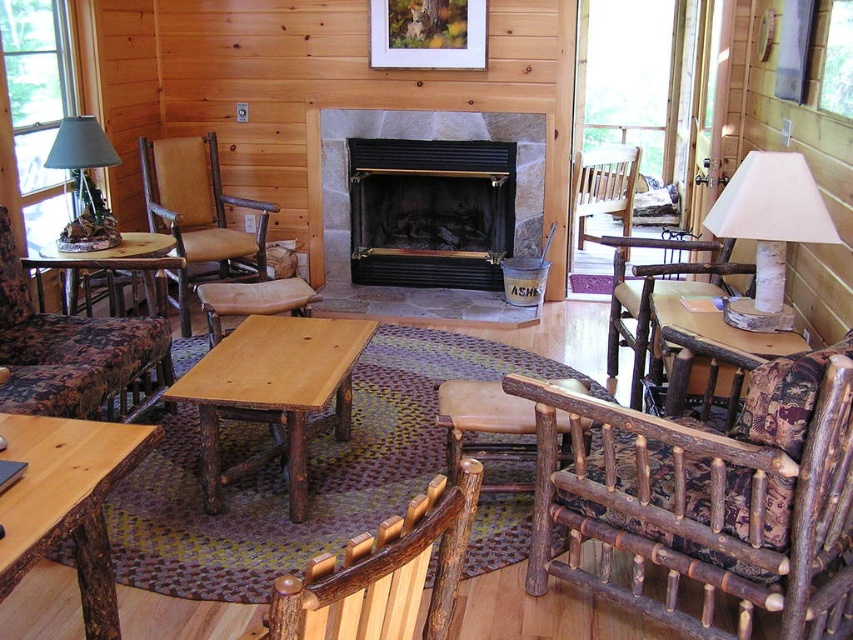
Question: Observing the image, what is the correct spatial positioning of natural wood table at center in reference to floral fabric armchair at left?

Choices:
 (A) left
 (B) right

Answer: (B)

Question: Which of the following is the farthest from the observer?

Choices:
 (A) (224, 289)
 (B) (67, 266)

Answer: (A)

Question: Can you confirm if black metal fireplace at center is positioned to the left of wooden table at left?

Choices:
 (A) no
 (B) yes

Answer: (A)

Question: Which point appears farthest from the camera in this image?

Choices:
 (A) (206, 317)
 (B) (784, 353)
 (C) (805, 221)

Answer: (A)

Question: Which is nearer to the wooden table at left?

Choices:
 (A) wooden armchair at right
 (B) black metal fireplace at center
 (C) wooden textured rocking chair at lower right
 (D) wooden table at center

Answer: (B)

Question: Is wooden stool at center to the right of wooden table at left from the viewer's perspective?

Choices:
 (A) yes
 (B) no

Answer: (A)